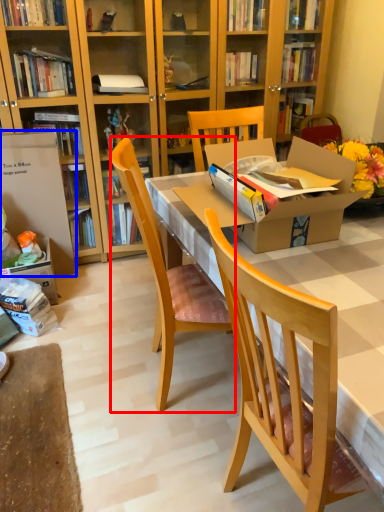
Question: Which object is further to the camera taking this photo, chair (highlighted by a red box) or box (highlighted by a blue box)?

Choices:
 (A) chair
 (B) box

Answer: (B)